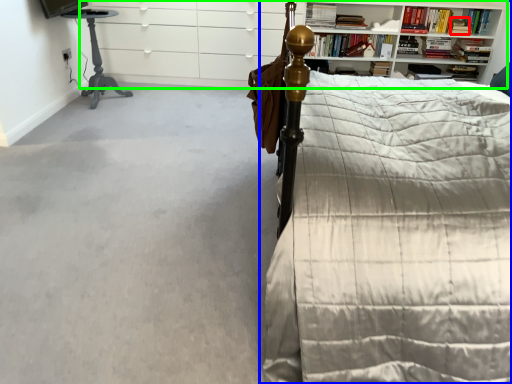
Question: Estimate the real-world distances between objects in this image. Which object is closer to book (highlighted by a red box), bed (highlighted by a blue box) or entertainment center (highlighted by a green box)?

Choices:
 (A) bed
 (B) entertainment center

Answer: (B)